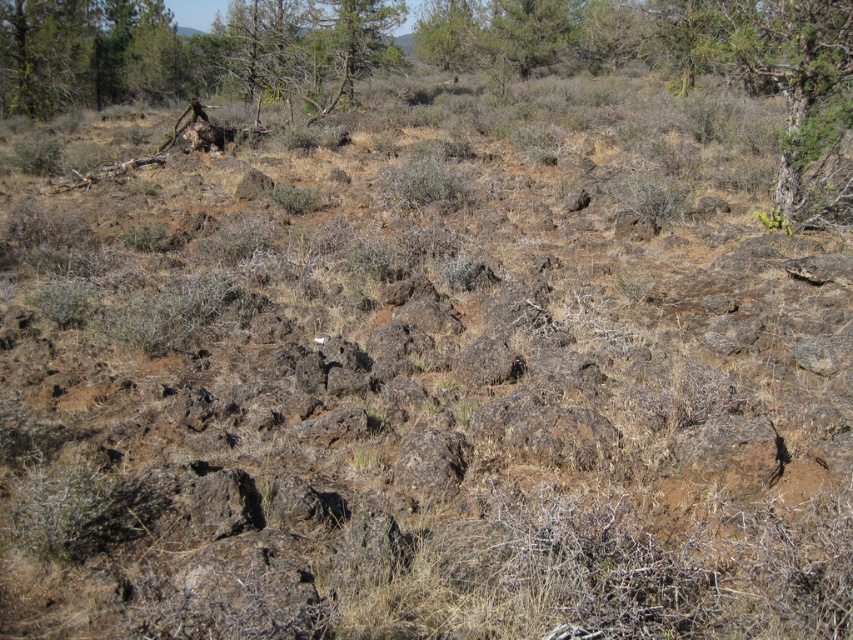
Question: Does smooth bark tree at upper right have a greater width compared to green leafy tree at upper center?

Choices:
 (A) yes
 (B) no

Answer: (A)

Question: Is smooth bark tree at upper right smaller than green leafy tree at upper center?

Choices:
 (A) no
 (B) yes

Answer: (A)

Question: Estimate the real-world distances between objects in this image. Which object is closer to the brown bark tree at upper left?

Choices:
 (A) green leafy tree at upper center
 (B) smooth bark tree at upper right

Answer: (A)

Question: Which point is farther to the camera?

Choices:
 (A) tap(379, 58)
 (B) tap(786, 150)
 (C) tap(85, 65)

Answer: (A)

Question: Estimate the real-world distances between objects in this image. Which object is farther from the brown bark tree at upper left?

Choices:
 (A) green leafy tree at upper center
 (B) smooth bark tree at upper right

Answer: (B)

Question: From the image, what is the correct spatial relationship of smooth bark tree at upper right in relation to green leafy tree at upper center?

Choices:
 (A) right
 (B) left

Answer: (A)